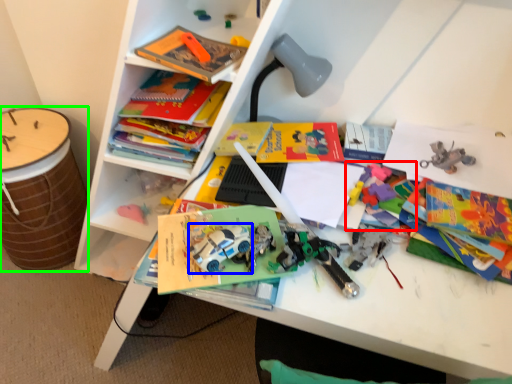
Question: Considering the real-world distances, which object is closest to toy (highlighted by a red box)? toy car (highlighted by a blue box) or drum (highlighted by a green box).

Choices:
 (A) toy car
 (B) drum

Answer: (A)